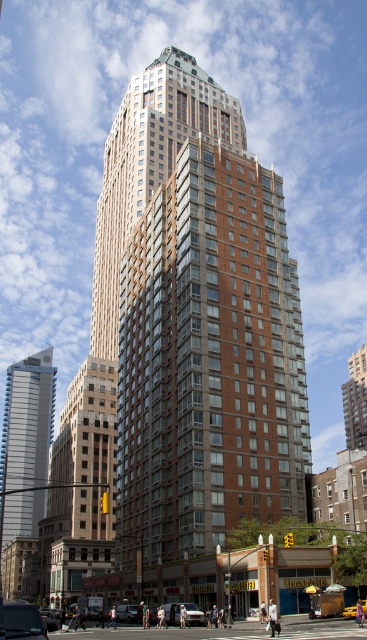
Question: Which object is the farthest from the brown brick building at center?

Choices:
 (A) metallic silver car at center
 (B) silver metallic car at lower center
 (C) silver metallic skyscraper at left
 (D) shiny black car at lower left

Answer: (D)

Question: Can you confirm if silver metallic skyscraper at left is positioned above metallic silver car at center?

Choices:
 (A) yes
 (B) no

Answer: (B)

Question: From the image, what is the correct spatial relationship of silver metallic skyscraper at left in relation to silver metallic car at lower center?

Choices:
 (A) below
 (B) above

Answer: (A)

Question: Is silver metallic skyscraper at left further to the viewer compared to yellow matte taxi cab at center?

Choices:
 (A) yes
 (B) no

Answer: (A)

Question: Estimate the real-world distances between objects in this image. Which object is closer to the shiny black car at lower left?

Choices:
 (A) yellow matte taxi cab at center
 (B) silver metallic car at lower center
 (C) brown brick building at center
 (D) metallic silver car at center

Answer: (D)

Question: Which point is farther to the camera?

Choices:
 (A) metallic silver car at center
 (B) shiny black car at lower left

Answer: (A)